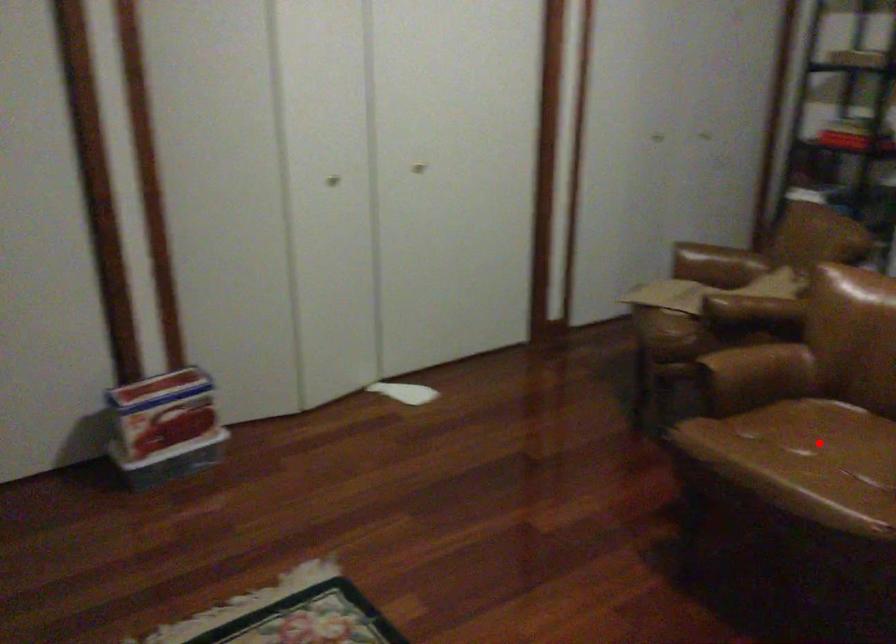
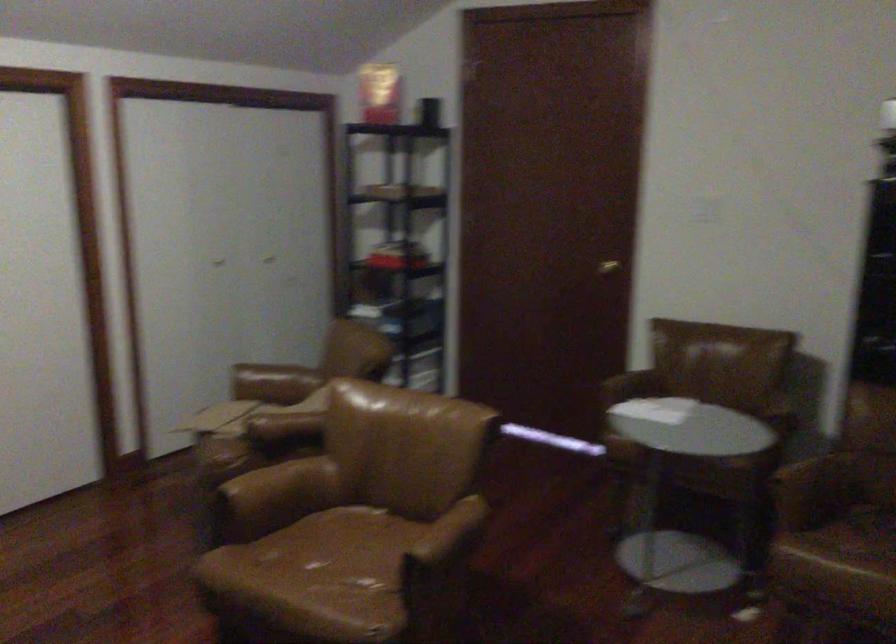
Locate, in the second image, the point that corresponds to the highlighted location in the first image.

(343, 556)